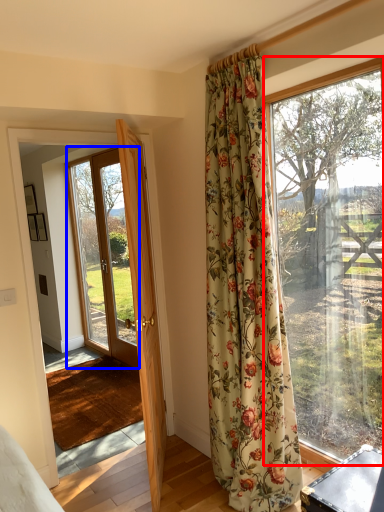
Question: Which object appears closest to the camera in this image, window (highlighted by a red box) or glass door (highlighted by a blue box)?

Choices:
 (A) window
 (B) glass door

Answer: (A)